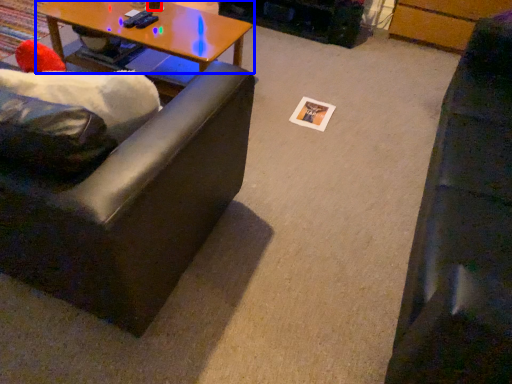
Question: Which of the following is the farthest to the observer, coffee cup (highlighted by a red box) or coffee table (highlighted by a blue box)?

Choices:
 (A) coffee cup
 (B) coffee table

Answer: (A)